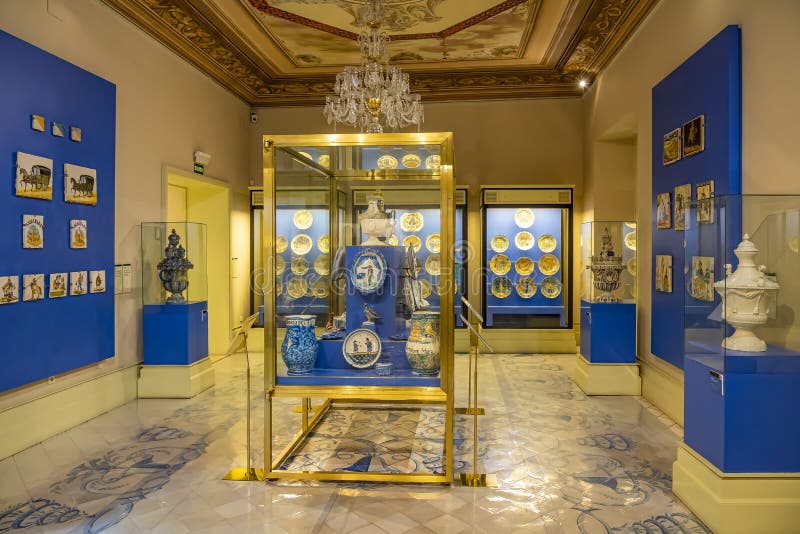
The width and height of the screenshot is (800, 534). I want to click on pillar, so click(602, 372), click(701, 488), click(174, 378).